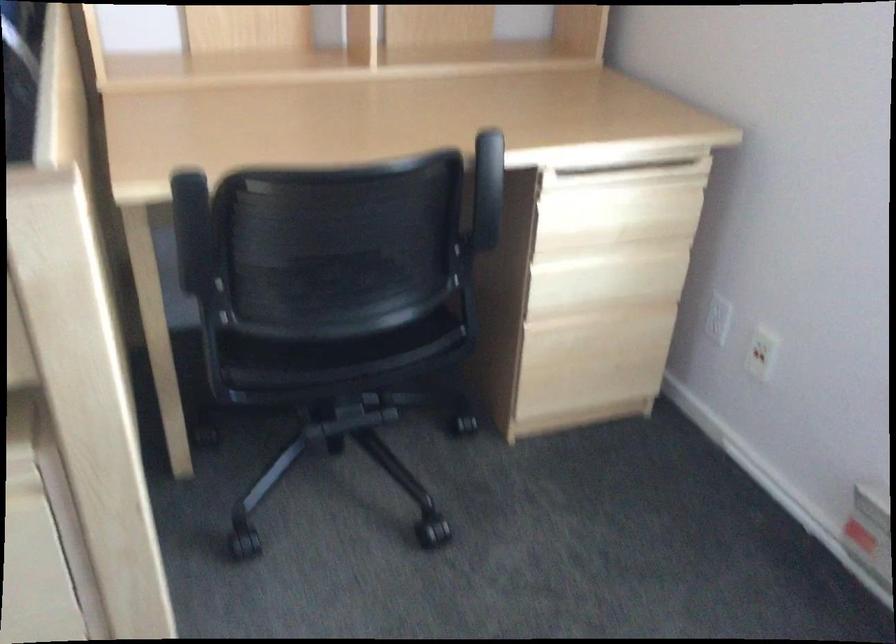
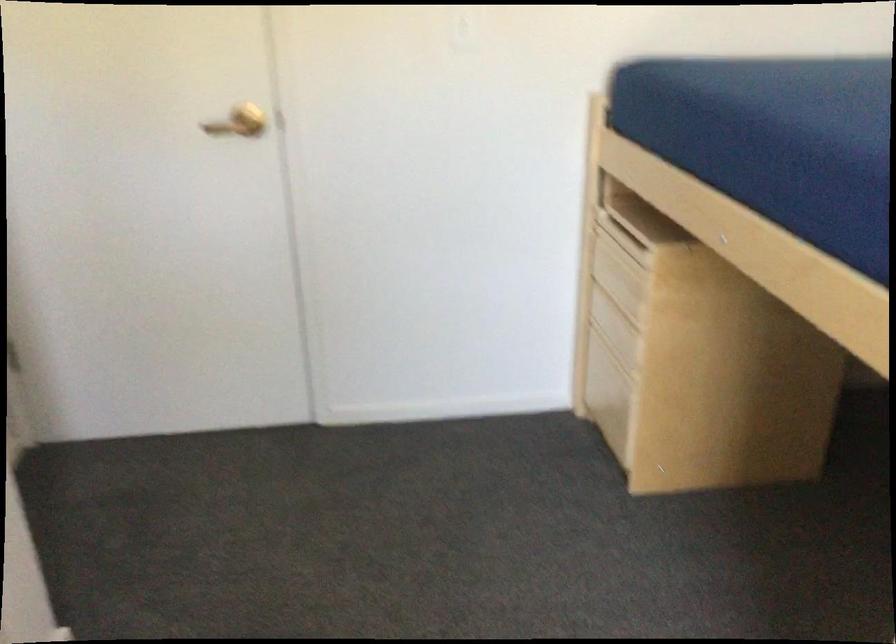
Based on the continuous images, in which direction is the camera rotating?

The camera's rotation is toward left-down.